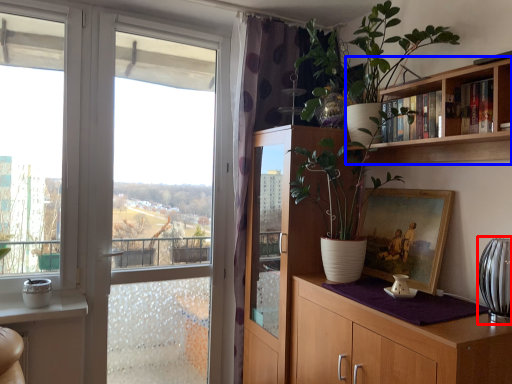
Question: Which of the following is the farthest to the observer, glass vase (highlighted by a red box) or bookcase (highlighted by a blue box)?

Choices:
 (A) glass vase
 (B) bookcase

Answer: (A)